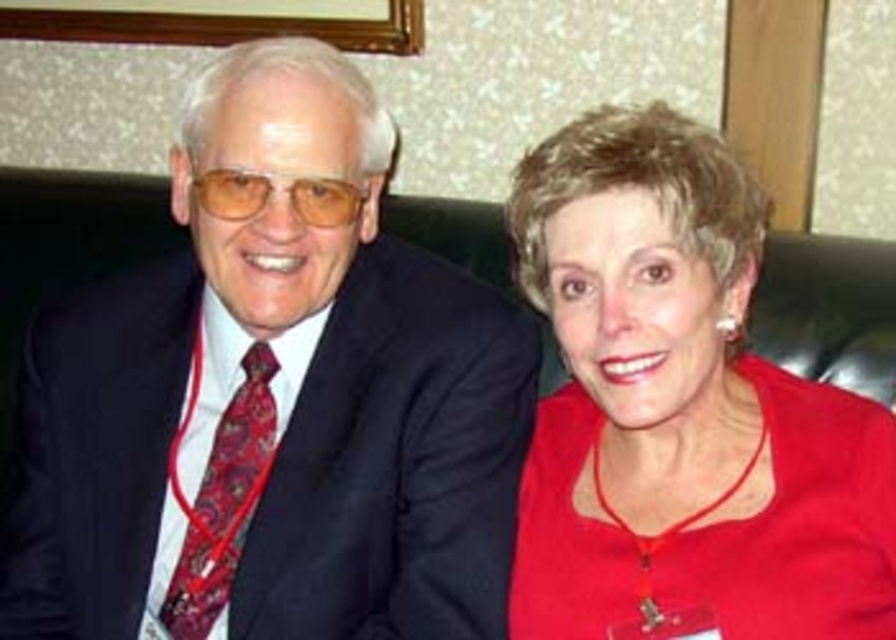
You are taking a photo of two people sitting in a formal setting. You notice two points in the image at coordinates point (714, 413) and point (214, 560). Which point is closer to the camera?

Point (714, 413) is closer to the camera than point (214, 560).

You are standing in front of the image and need to locate the matte black suit at left. According to the coordinates provided, where exactly is it positioned?

The matte black suit at left is located at point 0.623 on the horizontal axis and 0.306 on the vertical axis.

You are organizing a photo shoot and need to ensure that the matte black suit at left and the paisley silk tie at left are positioned correctly. Based on the scene description, which object should be placed farther back to maintain the same visual width as shown in the original image?

The matte black suit at left should be placed farther back than the paisley silk silk tie at left because the description states that the matte black suit at left might be wider than the paisley silk tie at left, implying that it needs to be positioned further away to maintain the same visual width.